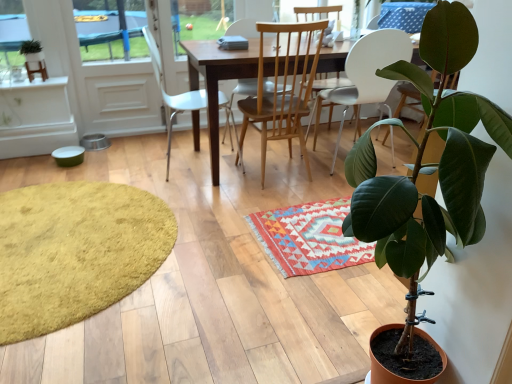
Find the location of a particular element. This screenshot has height=384, width=512. vacant area located to the right-hand side of yellow shaggy rug at lower left, which ranks as the 1th mat in left-to-right order is located at coordinates (247, 249).